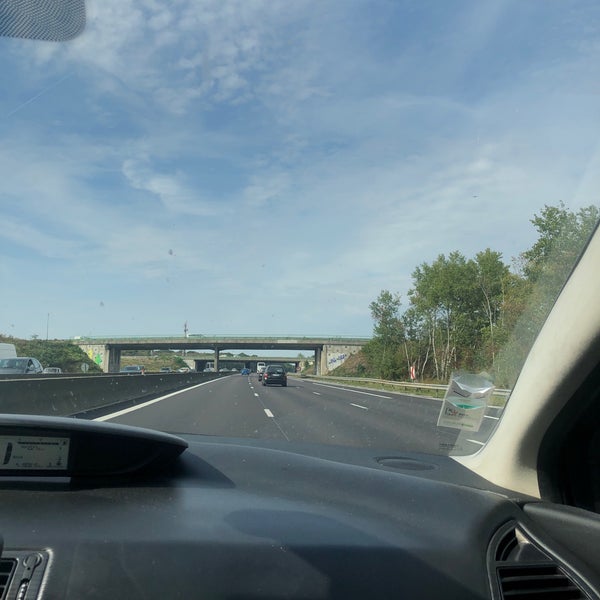
Where is `circle speaker`? circle speaker is located at coordinates (402, 460).